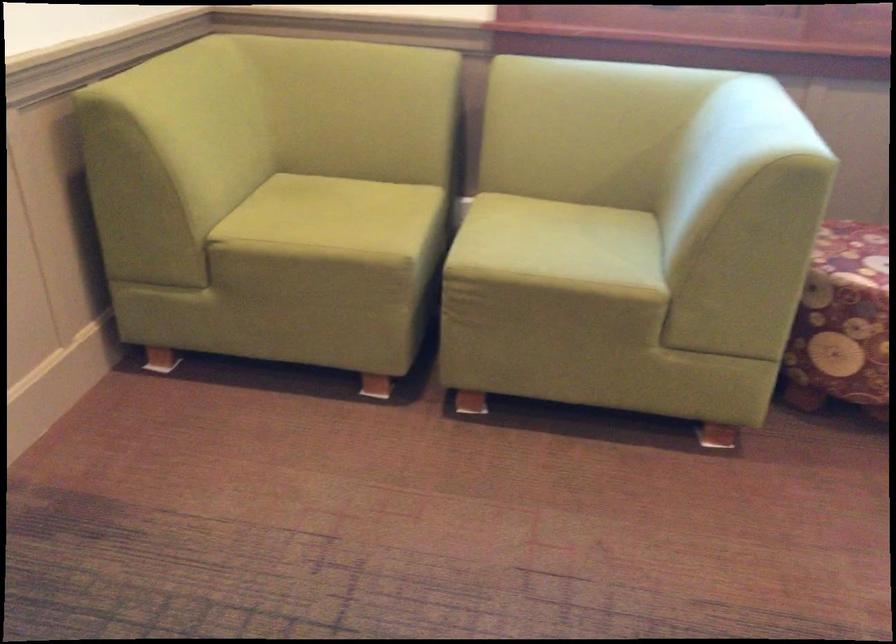
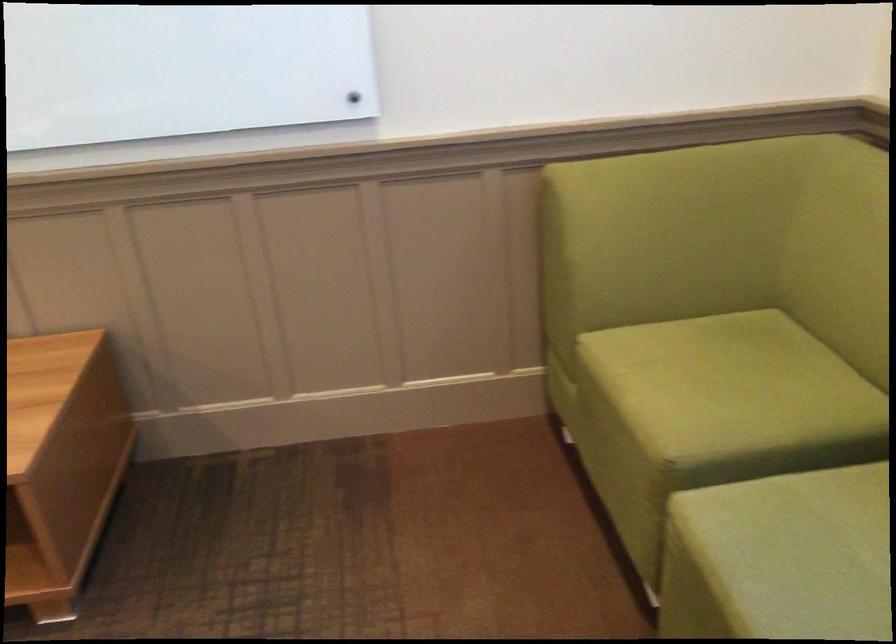
Where in the second image is the point corresponding to the point at 528,257 from the first image?

(780, 558)